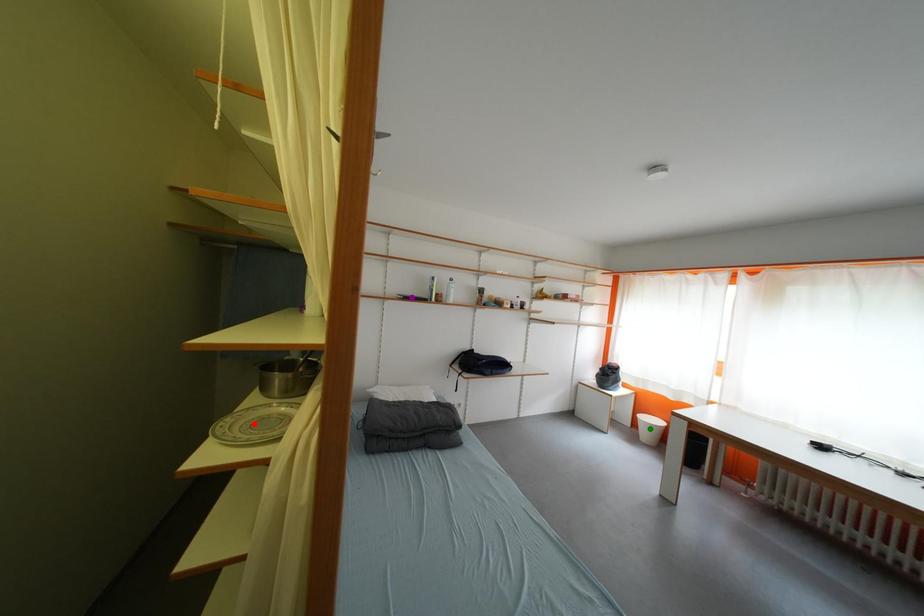
Order these from nearest to farthest:
red point
green point
purple point

red point, purple point, green point